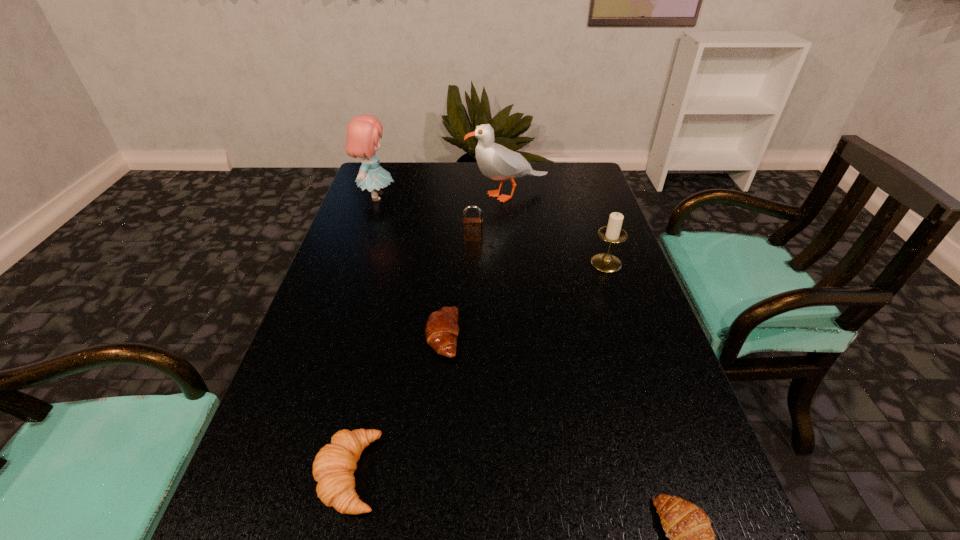
Identify the location of free space located 0.050m on the front-facing side of the doll. The image size is (960, 540). (412, 197).

At what (x,y) coordinates should I click in order to perform the action: click on free spot located 0.130m at the beak of the gull. Please return your answer as a coordinate pair (x, y). Looking at the image, I should click on [x=425, y=195].

Locate an element on the screen. This screenshot has width=960, height=540. vacant space located at the beak of the gull is located at coordinates (356, 195).

This screenshot has width=960, height=540. What are the coordinates of `vacant space located at the beak of the gull` in the screenshot? It's located at (378, 195).

Where is `free space located 0.240m on the back of the fifth shortest object`? Image resolution: width=960 pixels, height=540 pixels. free space located 0.240m on the back of the fifth shortest object is located at coordinates (587, 206).

The image size is (960, 540). I want to click on vacant region located on the front-facing side of the padlock, so click(471, 291).

Where is `vacant region located 0.320m on the back of the fifth tallest object`? vacant region located 0.320m on the back of the fifth tallest object is located at coordinates (387, 307).

Find the location of a particular element. Image resolution: width=960 pixels, height=540 pixels. vacant space positioned 0.330m on the front of the second crescent roll from left to right is located at coordinates (425, 539).

Where is `doll present at the far edge`? doll present at the far edge is located at coordinates (363, 132).

Where is `gull positioned at the far edge`? gull positioned at the far edge is located at coordinates (495, 161).